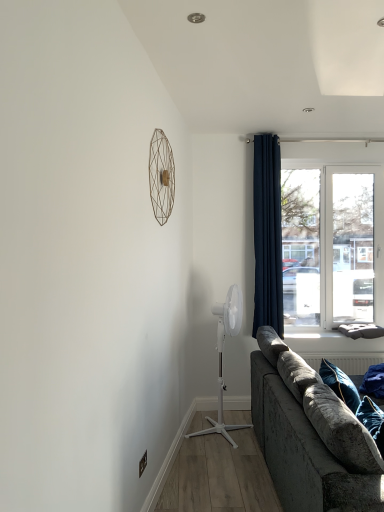
Question: Does white plastic fan at center, which appears as the 1th mechanical fan when viewed from the back, appear on the right side of transparent glass window at upper right?

Choices:
 (A) no
 (B) yes

Answer: (A)

Question: Is white plastic fan at center, placed as the first mechanical fan when sorted from bottom to top, closer to camera compared to transparent glass window at upper right?

Choices:
 (A) yes
 (B) no

Answer: (A)

Question: Is white plastic fan at center, which ranks as the first mechanical fan in right-to-left order, facing away from transparent glass window at upper right?

Choices:
 (A) yes
 (B) no

Answer: (B)

Question: Considering the relative sizes of white plastic fan at center, the 2th mechanical fan viewed from the left, and transparent glass window at upper right in the image provided, is white plastic fan at center, the 2th mechanical fan viewed from the left, bigger than transparent glass window at upper right?

Choices:
 (A) yes
 (B) no

Answer: (A)

Question: Considering the relative sizes of white plastic fan at center, which appears as the 1th mechanical fan when viewed from the back, and transparent glass window at upper right in the image provided, is white plastic fan at center, which appears as the 1th mechanical fan when viewed from the back, wider than transparent glass window at upper right?

Choices:
 (A) yes
 (B) no

Answer: (A)

Question: From the image's perspective, is navy blue fabric curtain at right positioned above or below transparent glass window at upper right?

Choices:
 (A) above
 (B) below

Answer: (A)

Question: Is point (253, 329) closer or farther from the camera than point (304, 323)?

Choices:
 (A) closer
 (B) farther

Answer: (A)

Question: From a real-world perspective, relative to transparent glass window at upper right, is navy blue fabric curtain at right vertically above or below?

Choices:
 (A) below
 (B) above

Answer: (B)

Question: Considering the positions of navy blue fabric curtain at right and transparent glass window at upper right in the image, is navy blue fabric curtain at right wider or thinner than transparent glass window at upper right?

Choices:
 (A) thin
 (B) wide

Answer: (B)

Question: From the image's perspective, relative to white plastic fan at center, placed as the first mechanical fan when sorted from bottom to top, is matte gold wire at upper center, marked as the 1th mechanical fan in a front-to-back arrangement, above or below?

Choices:
 (A) above
 (B) below

Answer: (A)

Question: Is matte gold wire at upper center, which is the first mechanical fan from left to right, to the left or to the right of white plastic fan at center, which ranks as the first mechanical fan in right-to-left order, in the image?

Choices:
 (A) right
 (B) left

Answer: (B)

Question: Is matte gold wire at upper center, which is the first mechanical fan from left to right, bigger or smaller than white plastic fan at center, which appears as the 1th mechanical fan when viewed from the back?

Choices:
 (A) big
 (B) small

Answer: (B)

Question: Is matte gold wire at upper center, the 2th mechanical fan ordered from the bottom, in front of or behind white plastic fan at center, the 2th mechanical fan in the top-to-bottom sequence, in the image?

Choices:
 (A) behind
 (B) front

Answer: (B)

Question: In terms of height, does velvet grey couch at lower right look taller or shorter compared to white plastic fan at center, positioned as the second mechanical fan in front-to-back order?

Choices:
 (A) short
 (B) tall

Answer: (A)

Question: Looking at the image, does velvet grey couch at lower right seem bigger or smaller compared to white plastic fan at center, the 2th mechanical fan in the top-to-bottom sequence?

Choices:
 (A) small
 (B) big

Answer: (B)